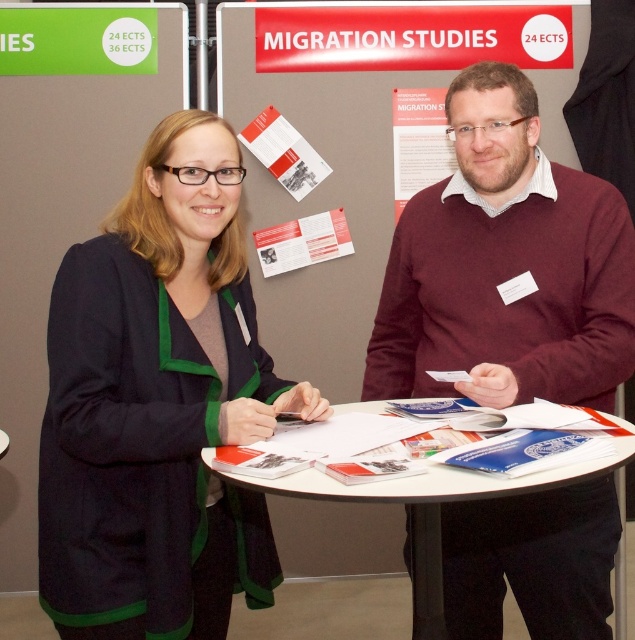
Question: Does maroon sweater at center appear over matte paper brochure at upper center?

Choices:
 (A) no
 (B) yes

Answer: (A)

Question: Which point is farther from the camera taking this photo?

Choices:
 (A) (48, 45)
 (B) (340, 244)

Answer: (B)

Question: Among these points, which one is nearest to the camera?

Choices:
 (A) 4,33
 (B) 159,392
 (C) 439,115

Answer: (B)

Question: Considering the real-world distances, which object is farthest from the maroon sweater at center?

Choices:
 (A) red glossy poster at upper center
 (B) matte paper brochure at center
 (C) white paper at center

Answer: (A)

Question: Is dark green textured cardigan at center bigger than matte paper brochure at upper center?

Choices:
 (A) yes
 (B) no

Answer: (A)

Question: Does white paper poster at upper center come behind matte paper brochure at center?

Choices:
 (A) no
 (B) yes

Answer: (A)